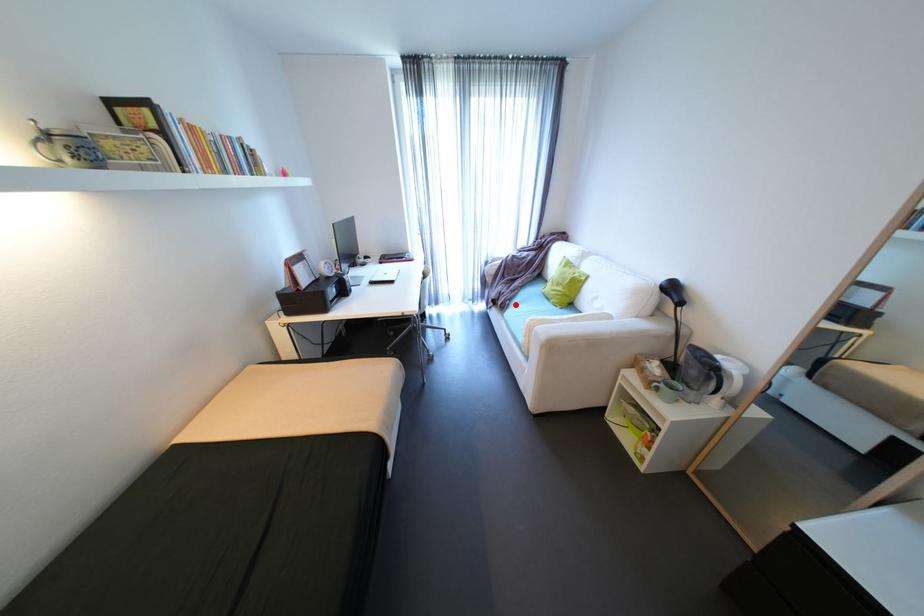
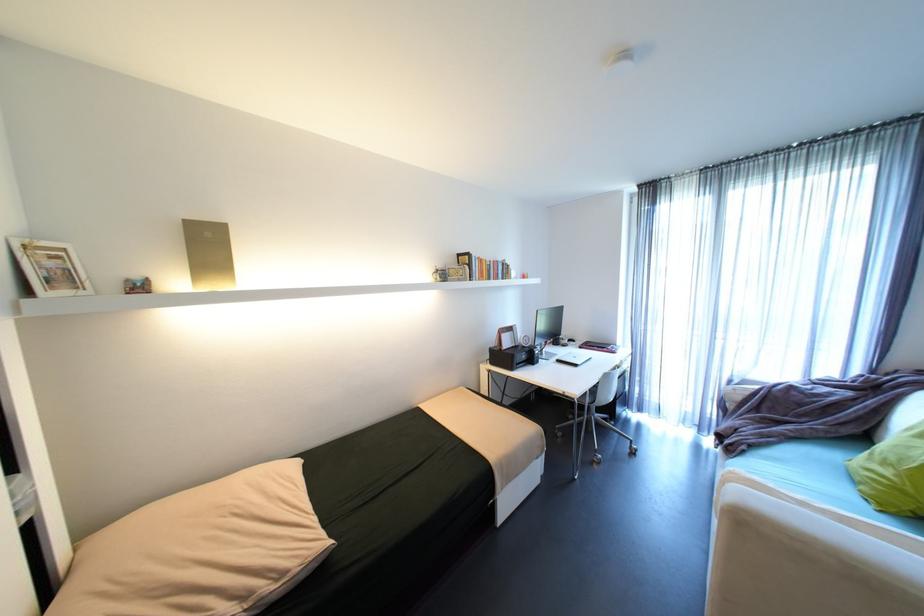
In the second image, find the point that corresponds to the highlighted location in the first image.

(751, 451)